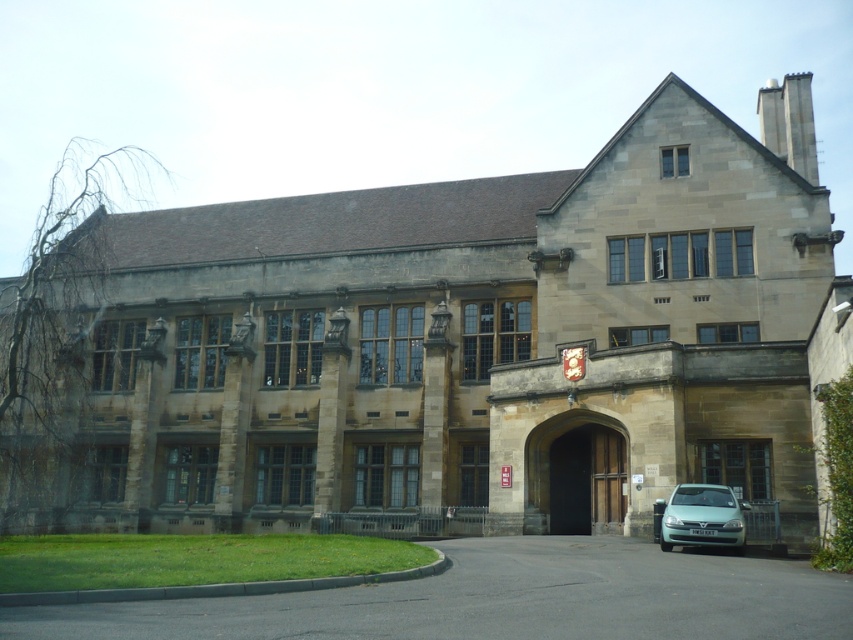
Question: Is black asphalt driveway at lower center further to camera compared to brown wooden door at center?

Choices:
 (A) yes
 (B) no

Answer: (B)

Question: Is brown wooden door at center to the left of light blue metallic hatchback at lower right from the viewer's perspective?

Choices:
 (A) no
 (B) yes

Answer: (B)

Question: Which is farther from the light blue metallic hatchback at lower right?

Choices:
 (A) black asphalt driveway at lower center
 (B) brown wooden door at center

Answer: (B)

Question: Estimate the real-world distances between objects in this image. Which object is farther from the black asphalt driveway at lower center?

Choices:
 (A) light blue metallic hatchback at lower right
 (B) brown wooden door at center

Answer: (B)

Question: Which point is closer to the camera?

Choices:
 (A) (606, 417)
 (B) (596, 618)
 (C) (663, 547)

Answer: (B)

Question: From the image, what is the correct spatial relationship of black asphalt driveway at lower center in relation to brown wooden door at center?

Choices:
 (A) left
 (B) right

Answer: (A)